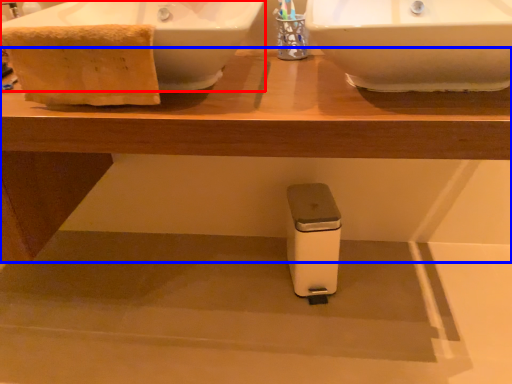
Question: Which of the following is the farthest to the observer, sink (highlighted by a red box) or table (highlighted by a blue box)?

Choices:
 (A) sink
 (B) table

Answer: (A)